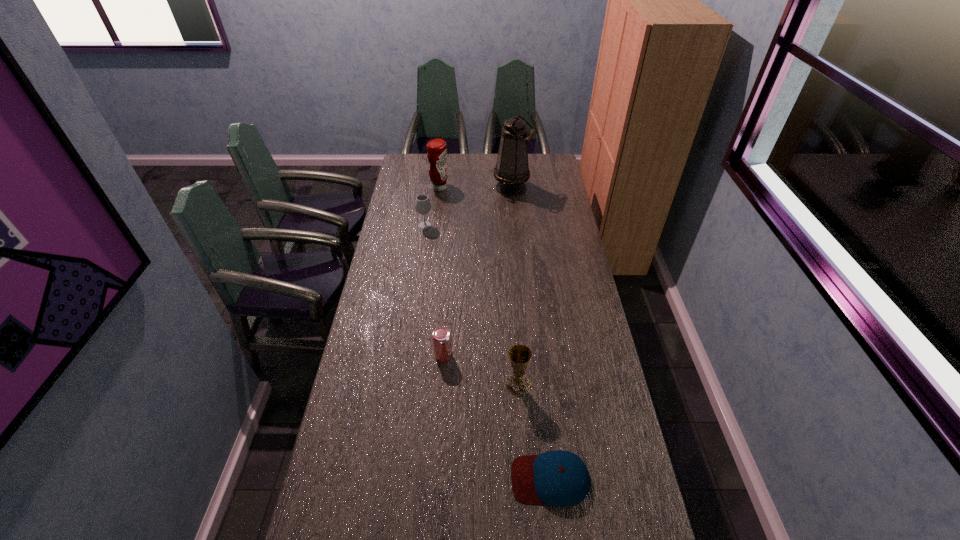
The image size is (960, 540). Identify the location of oil lamp. (512, 171).

You are a GUI agent. You are given a task and a screenshot of the screen. Output one action in this format:
    pyautogui.click(x=<x>, y=<y>)
    Task: Click on the condiment
    
    Given the screenshot: What is the action you would take?
    pyautogui.click(x=437, y=151)

You are a GUI agent. You are given a task and a screenshot of the screen. Output one action in this format:
    pyautogui.click(x=<x>, y=<y>)
    Task: Click on the chalice
    This screenshot has height=540, width=960.
    Given the screenshot: What is the action you would take?
    pyautogui.click(x=520, y=355)

I want to click on wineglass, so click(x=422, y=204).

This screenshot has width=960, height=540. What are the coordinates of `the third nearest object` in the screenshot? It's located at (441, 337).

The height and width of the screenshot is (540, 960). In order to click on the third object from left to right in this screenshot , I will do `click(441, 337)`.

The height and width of the screenshot is (540, 960). Find the location of `baseball cap`. baseball cap is located at coordinates (559, 478).

Find the location of a particular element. The width and height of the screenshot is (960, 540). the nearest object is located at coordinates (559, 478).

You are a GUI agent. You are given a task and a screenshot of the screen. Output one action in this format:
    pyautogui.click(x=<x>, y=<y>)
    Task: Click on the blank area located 0.130m on the back of the tallest object
    
    Given the screenshot: What is the action you would take?
    (510, 165)

Where is `free space located 0.180m on the left of the condiment`? free space located 0.180m on the left of the condiment is located at coordinates (396, 188).